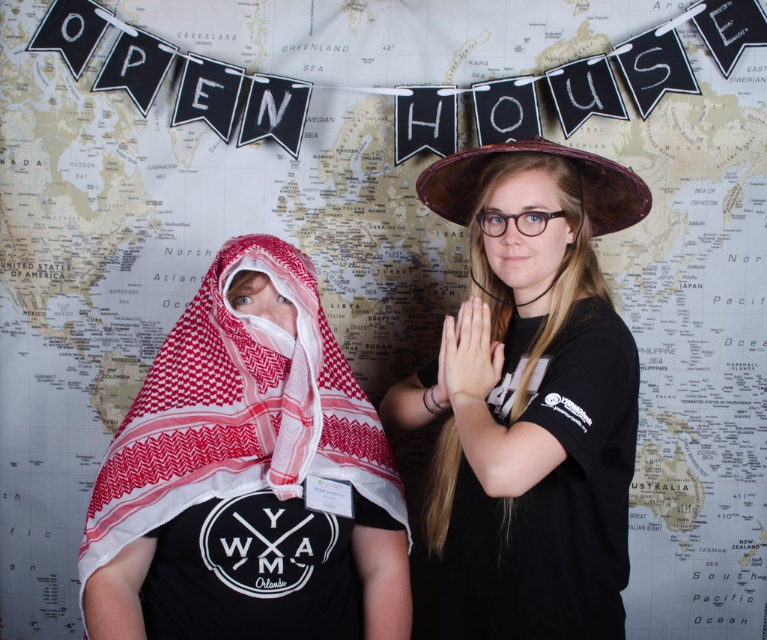
What is located at the coordinate point (x=247, y=476) in the image?

→ The point (x=247, y=476) is occupied by the red and white woven cloth at left.